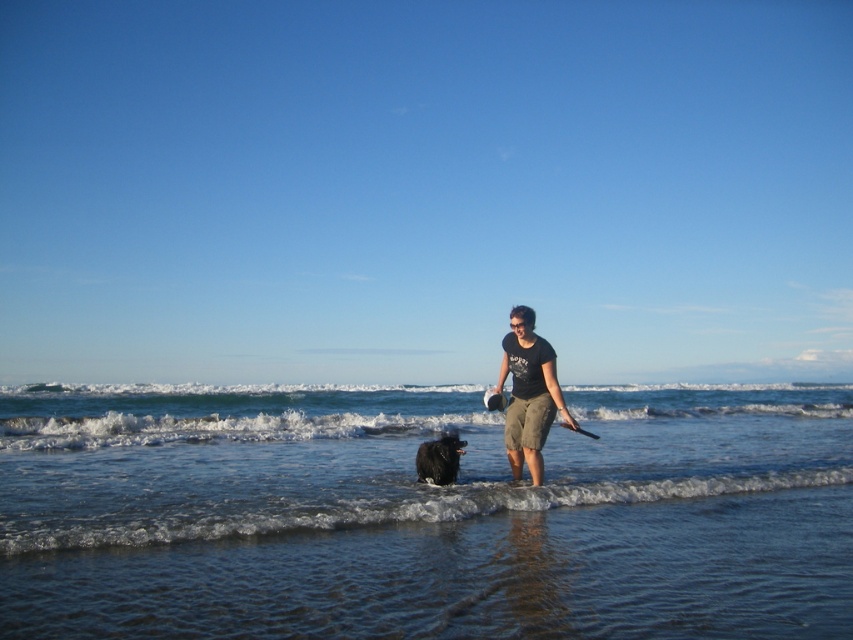
You are a photographer standing at the edge of the beach. You want to take a photo of the black fluffy dog at center and the clear water at lower center. If you need both subjects to be in focus, which one should you focus on first to ensure the other is also sharp?

Since the clear water at lower center is 19.11 meters from the black fluffy dog at center, you should focus on the black fluffy dog at center first because it is closer to the camera, ensuring the clear water at lower center will also be in focus within the depth of field.